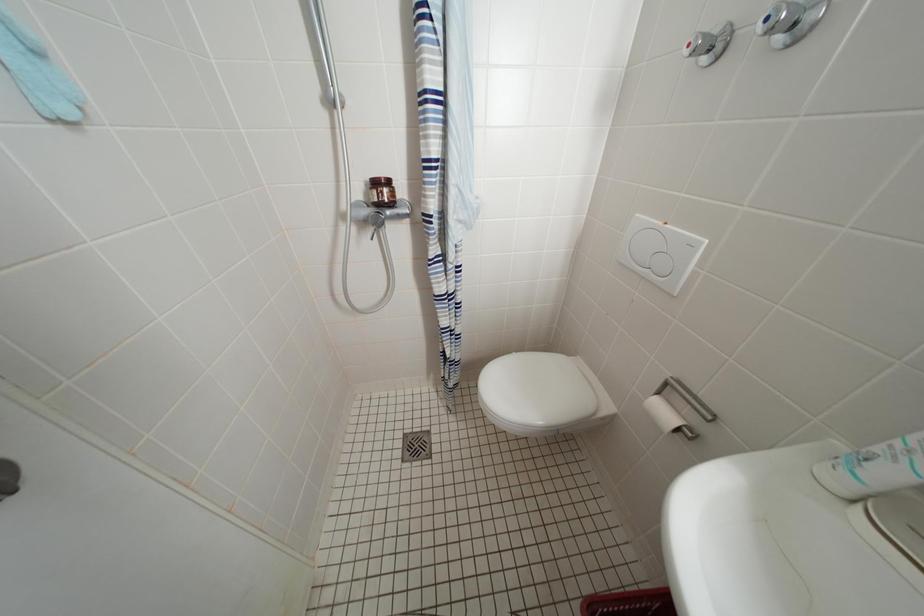
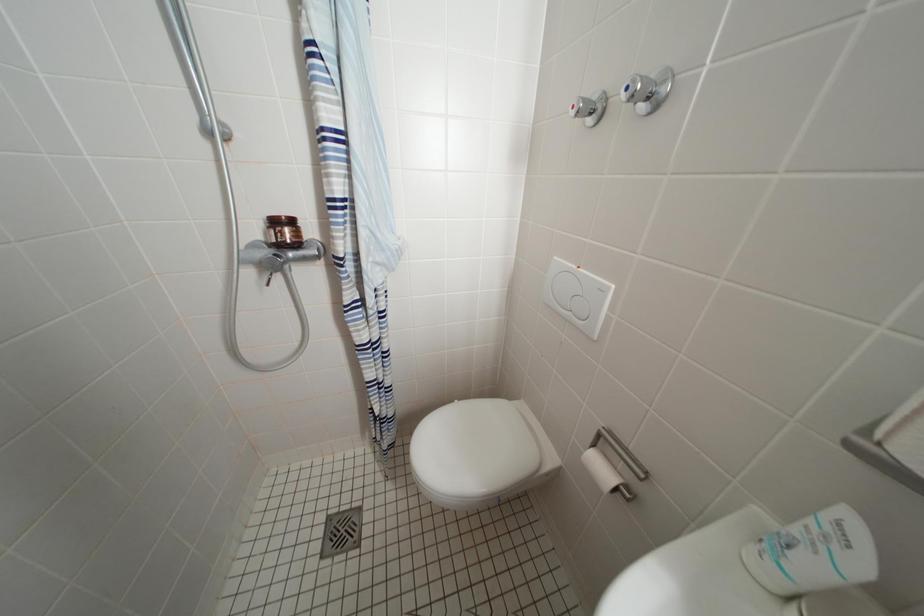
Question: Based on the continuous images, in which direction is the camera rotating? Reply with the corresponding letter.

Choices:
 (A) Left
 (B) Right
 (C) Up
 (D) Down

Answer: (B)